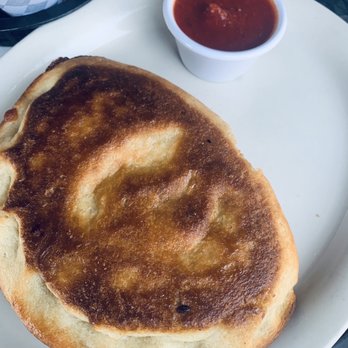
Identify the location of table cover. This screenshot has width=348, height=348. (340, 11), (346, 342), (4, 49).